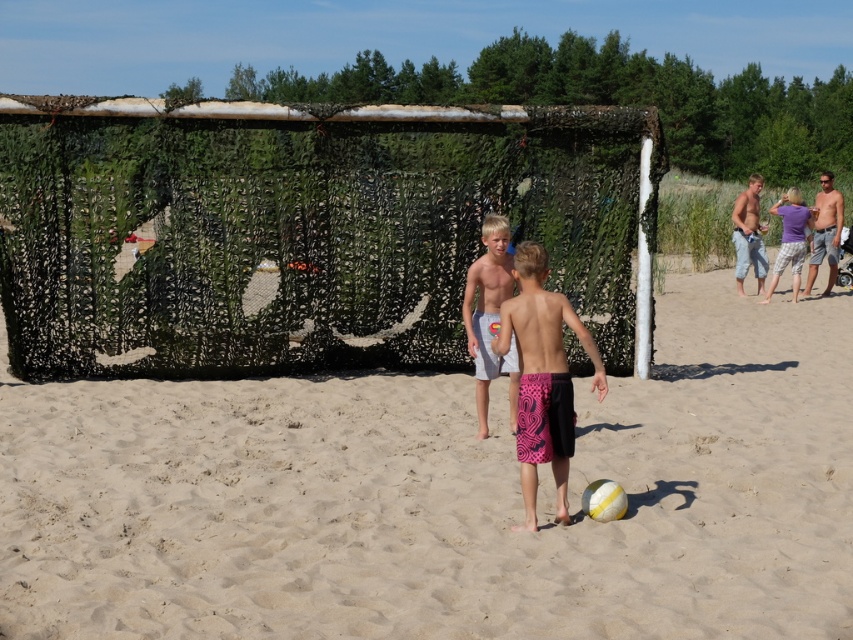
Question: From the image, what is the correct spatial relationship of tan skin shirtless man at right in relation to yellow/white striped volleyball at lower center?

Choices:
 (A) below
 (B) above

Answer: (B)

Question: Estimate the real-world distances between objects in this image. Which object is closer to the camouflage netting at center?

Choices:
 (A) tan skin shirtless man at right
 (B) purple cotton shirt at upper right

Answer: (B)

Question: Which is farther from the pink patterned shorts at center?

Choices:
 (A) purple cotton shirt at upper right
 (B) light blue denim shorts at right
 (C) camouflage netting at center

Answer: (B)

Question: In this image, where is camouflage netting at center located relative to white cotton shorts at center?

Choices:
 (A) above
 (B) below

Answer: (B)

Question: Can you confirm if white cotton shorts at center is positioned to the left of tan skin shirtless man at right?

Choices:
 (A) yes
 (B) no

Answer: (A)

Question: Which object is positioned closest to the purple cotton shirt at upper right?

Choices:
 (A) pink patterned shorts at center
 (B) yellow/white striped volleyball at lower center
 (C) tan skin shirtless man at right

Answer: (C)